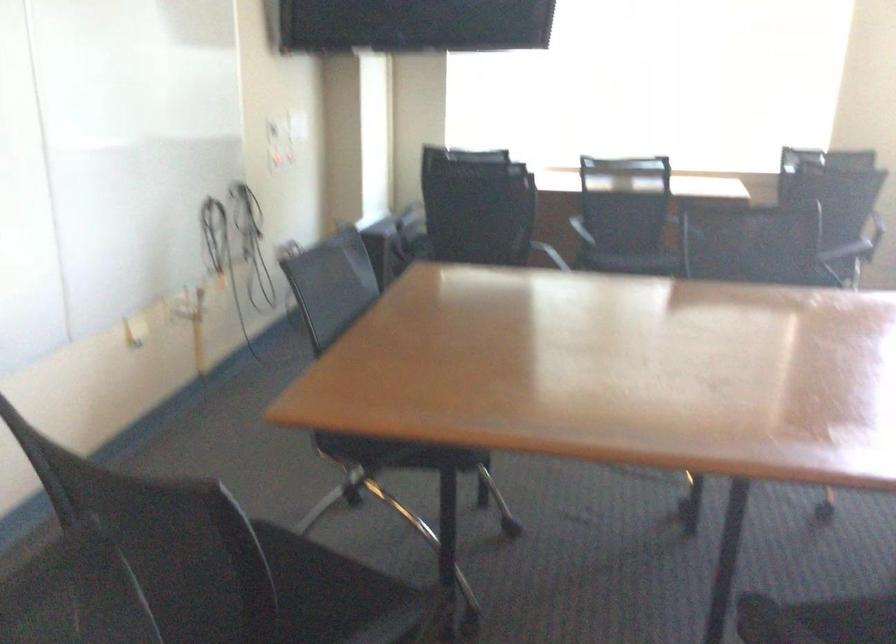
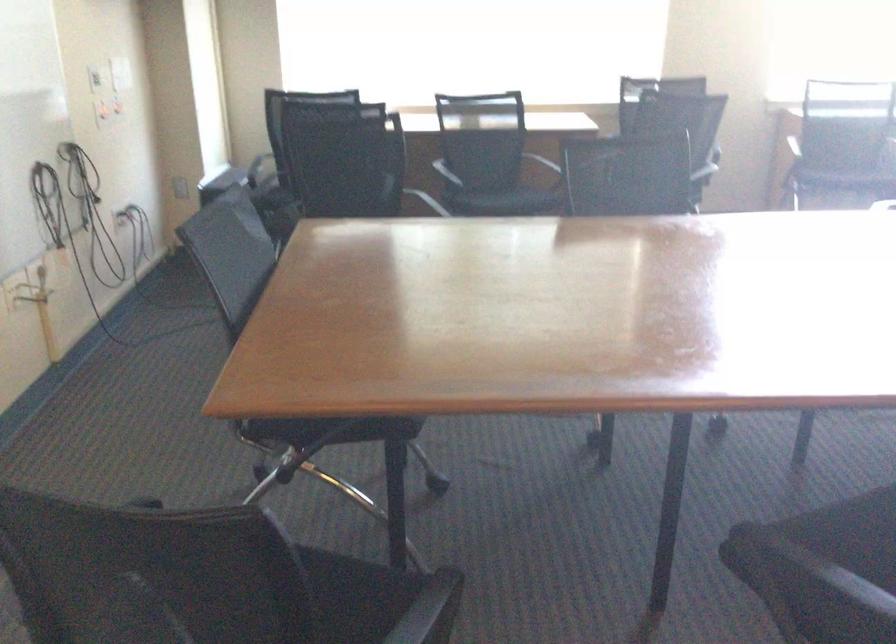
Which direction would the cameraman need to move to produce the second image?

The cameraman moved toward left, forward.